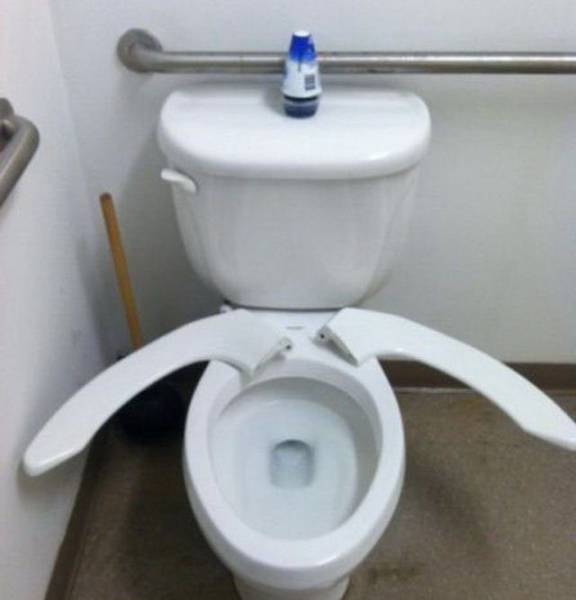
Where is `air freshner`? This screenshot has height=600, width=576. air freshner is located at coordinates (302, 71).